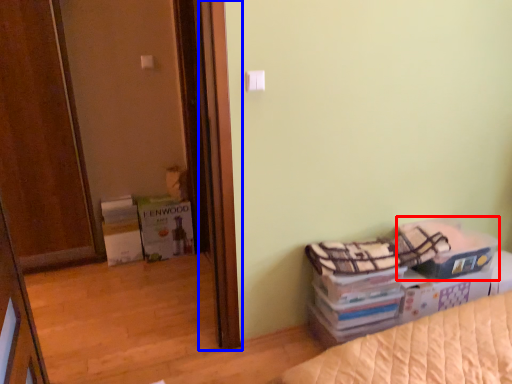
Question: Which object appears farthest to the camera in this image, storage box (highlighted by a red box) or screen door (highlighted by a blue box)?

Choices:
 (A) storage box
 (B) screen door

Answer: (B)